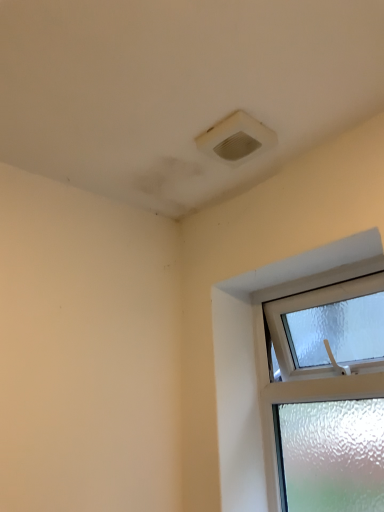
Question: In terms of width, does white plastic air conditioning at upper center look wider or thinner when compared to clear glass window at upper right?

Choices:
 (A) thin
 (B) wide

Answer: (B)

Question: Relative to clear glass window at upper right, is white plastic air conditioning at upper center in front or behind?

Choices:
 (A) front
 (B) behind

Answer: (B)

Question: From their relative heights in the image, would you say white plastic air conditioning at upper center is taller or shorter than clear glass window at upper right?

Choices:
 (A) tall
 (B) short

Answer: (B)

Question: In terms of size, does clear glass window at upper right appear bigger or smaller than white plastic air conditioning at upper center?

Choices:
 (A) small
 (B) big

Answer: (B)

Question: Choose the correct answer: Is clear glass window at upper right inside white plastic air conditioning at upper center or outside it?

Choices:
 (A) outside
 (B) inside

Answer: (A)

Question: Considering the positions of point (248, 366) and point (233, 117), is point (248, 366) closer or farther from the camera than point (233, 117)?

Choices:
 (A) closer
 (B) farther

Answer: (B)

Question: Relative to white plastic air conditioning at upper center, is clear glass window at upper right in front or behind?

Choices:
 (A) behind
 (B) front

Answer: (B)